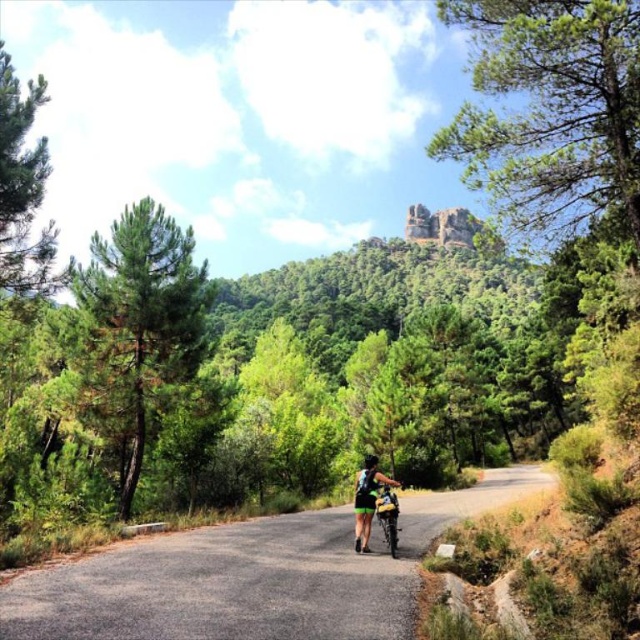
Which is above, gray asphalt road at center or metallic silver bicycle at center?

metallic silver bicycle at center is higher up.

Can you confirm if gray asphalt road at center is positioned to the right of metallic silver bicycle at center?

In fact, gray asphalt road at center is to the left of metallic silver bicycle at center.

Is point (42, 595) closer to camera compared to point (388, 552)?

That is True.

Identify the location of gray asphalt road at center. Image resolution: width=640 pixels, height=640 pixels. (252, 577).

Can you confirm if gray asphalt road at center is bigger than green matte shorts at center?

Correct, gray asphalt road at center is larger in size than green matte shorts at center.

Is point (180, 620) in front of point (356, 540)?

Yes, point (180, 620) is in front of point (356, 540).

Which is in front, point (392, 586) or point (381, 484)?

Positioned in front is point (392, 586).

The image size is (640, 640). What are the coordinates of `gray asphalt road at center` in the screenshot? It's located at (252, 577).

Between green matte shorts at center and metallic silver bicycle at center, which one appears on the right side from the viewer's perspective?

Positioned to the right is green matte shorts at center.

The width and height of the screenshot is (640, 640). Describe the element at coordinates (368, 499) in the screenshot. I see `green matte shorts at center` at that location.

Locate an element on the screen. green matte shorts at center is located at coordinates (368, 499).